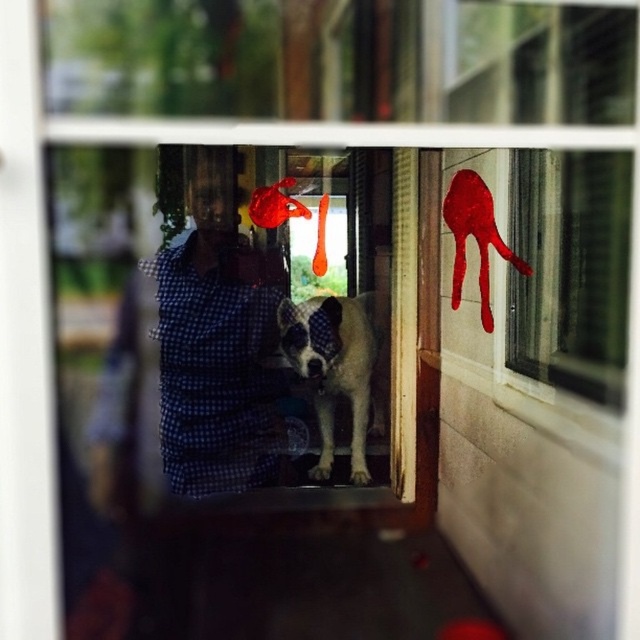
Does point (228, 342) come behind point (324, 422)?

No, (228, 342) is closer to viewer.

Can you confirm if blue checkered shirt at center is shorter than white fur dog at center?

Incorrect, blue checkered shirt at center's height does not fall short of white fur dog at center's.

You are a GUI agent. You are given a task and a screenshot of the screen. Output one action in this format:
    pyautogui.click(x=<x>, y=<y>)
    Task: Click on the blue checkered shirt at center
    The height and width of the screenshot is (640, 640).
    Given the screenshot: What is the action you would take?
    pyautogui.click(x=218, y=342)

Can you confirm if white fur dog at center is thinner than smooth glossy paw print at upper right?

In fact, white fur dog at center might be wider than smooth glossy paw print at upper right.

Between white fur dog at center and smooth glossy paw print at upper right, which one appears on the left side from the viewer's perspective?

Positioned to the left is white fur dog at center.

Which is behind, point (307, 342) or point (483, 316)?

The point (307, 342) is behind.

The image size is (640, 640). I want to click on white fur dog at center, so click(x=333, y=368).

Can you confirm if transparent glass window at upper right is thinner than smooth glossy paw print at upper right?

In fact, transparent glass window at upper right might be wider than smooth glossy paw print at upper right.

Describe the element at coordinates (570, 269) in the screenshot. This screenshot has width=640, height=640. I see `transparent glass window at upper right` at that location.

Locate an element on the screen. The height and width of the screenshot is (640, 640). transparent glass window at upper right is located at coordinates (570, 269).